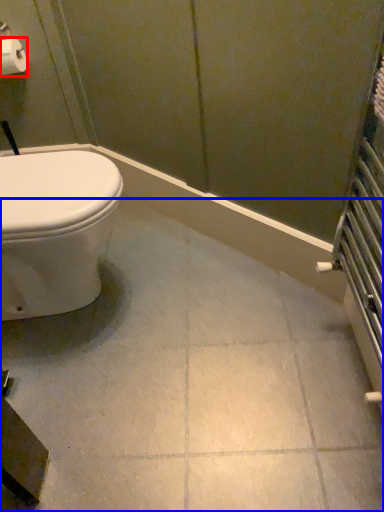
Question: Which object is further to the camera taking this photo, toilet paper (highlighted by a red box) or ceramic tile (highlighted by a blue box)?

Choices:
 (A) toilet paper
 (B) ceramic tile

Answer: (A)